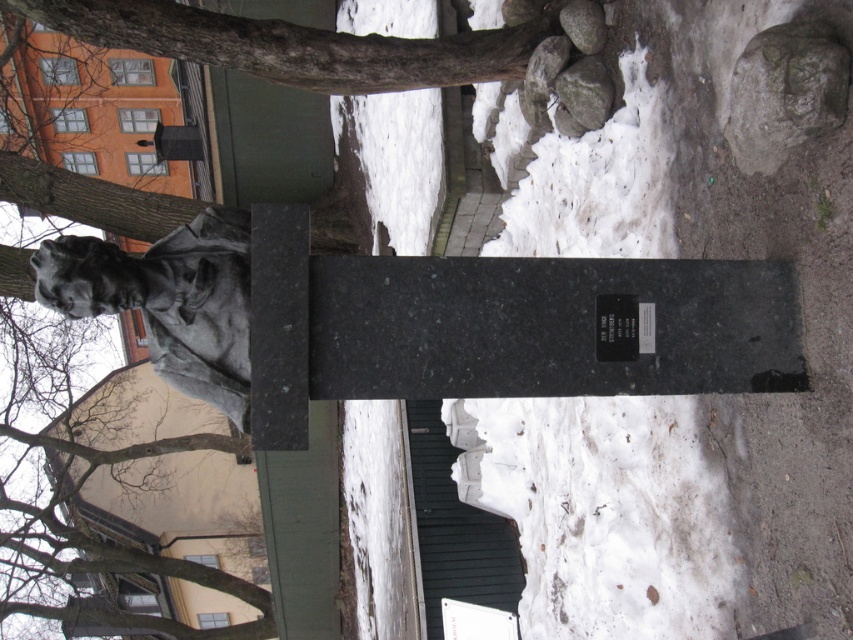
Question: Which of the following is the farthest from the observer?

Choices:
 (A) (595, 90)
 (B) (486, 168)
 (C) (791, 129)

Answer: (B)

Question: Among these points, which one is farthest from the camera?

Choices:
 (A) [302, 12]
 (B) [798, 141]

Answer: (A)

Question: Does brown rough bark at upper center come in front of gray rough stone at upper center?

Choices:
 (A) no
 (B) yes

Answer: (B)

Question: Does brown rough bark at upper center appear under smooth gray rock at upper right?

Choices:
 (A) yes
 (B) no

Answer: (A)

Question: Can you confirm if brown rough bark at upper center is thinner than smooth gray rock at upper right?

Choices:
 (A) yes
 (B) no

Answer: (B)

Question: Which object is positioned farthest from the brown rough bark at upper center?

Choices:
 (A) smooth gray rock at upper right
 (B) gray rough stone at upper center

Answer: (A)